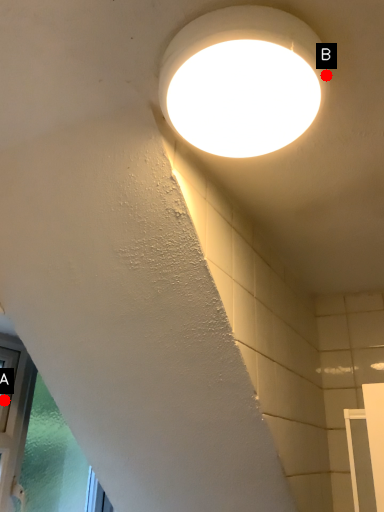
Question: Two points are circled on the image, labeled by A and B beside each circle. Which point appears closest to the camera in this image?

Choices:
 (A) A is closer
 (B) B is closer

Answer: (B)